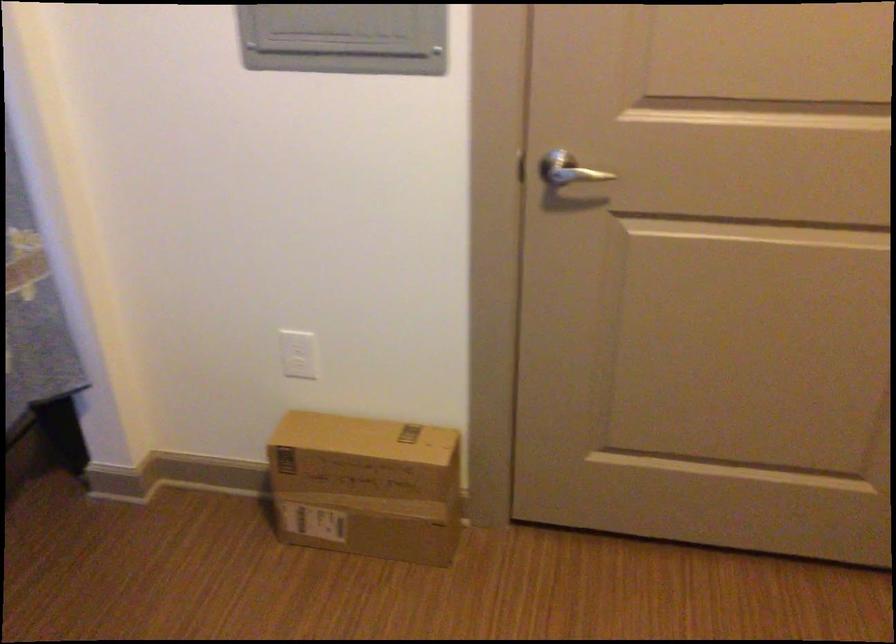
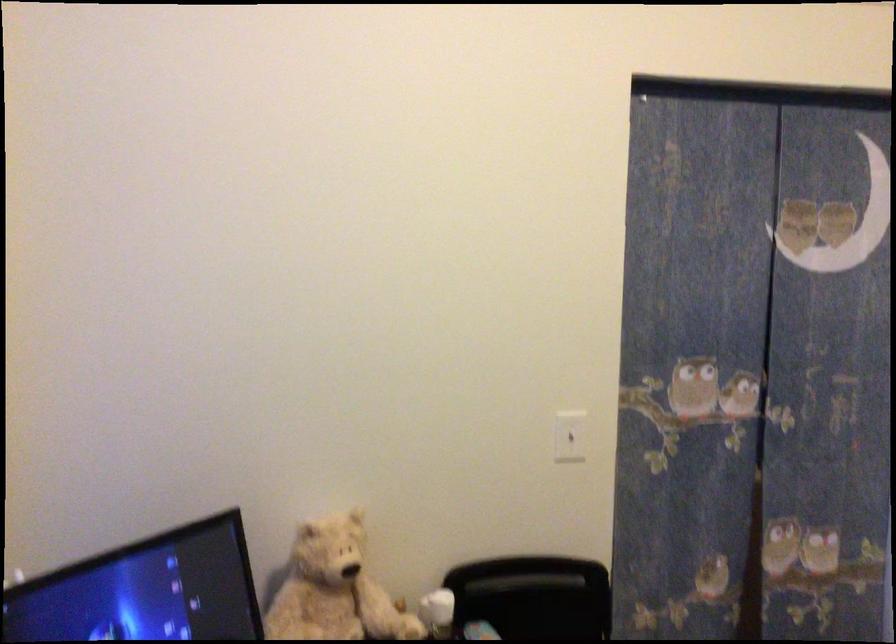
Question: The images are taken continuously from a first-person perspective. In which direction is your viewpoint rotating?

Choices:
 (A) Left
 (B) Right
 (C) Up
 (D) Down

Answer: (A)